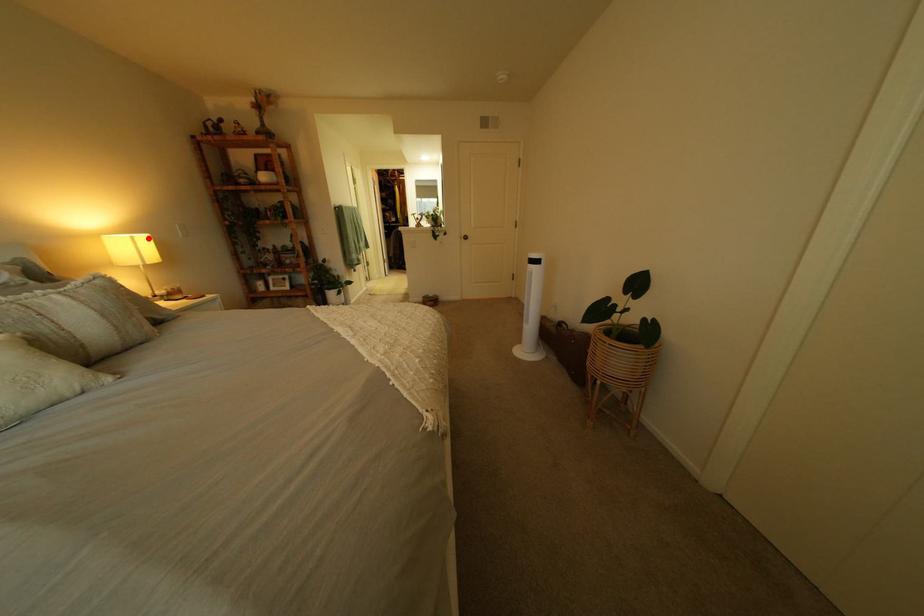
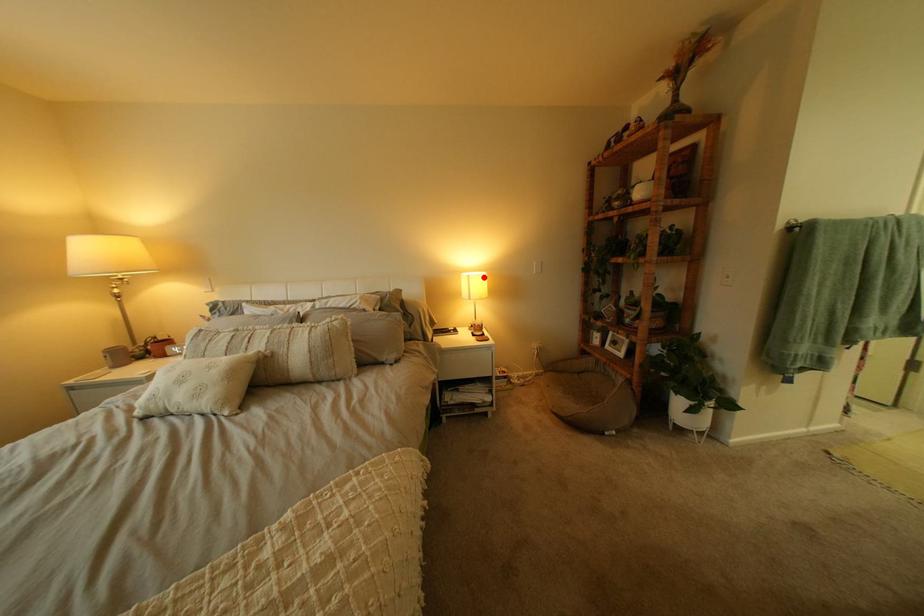
I am providing you with two images of the same scene from different viewpoints. A red point is marked on the first image and another point is marked on the second image. Are the points marked in image1 and image2 representing the same 3D position?

Yes